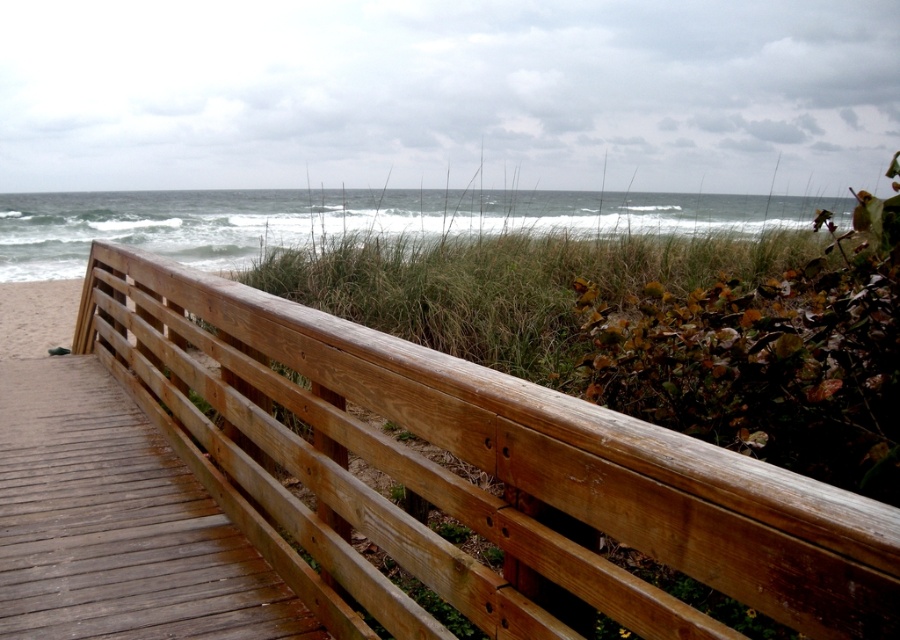
Between point (639, 627) and point (216, 531), which one is positioned behind?

The point (216, 531) is more distant.

Is point (693, 508) closer to camera compared to point (65, 458)?

Yes, it is.

Where is `natural wood rail at center`? natural wood rail at center is located at coordinates (466, 477).